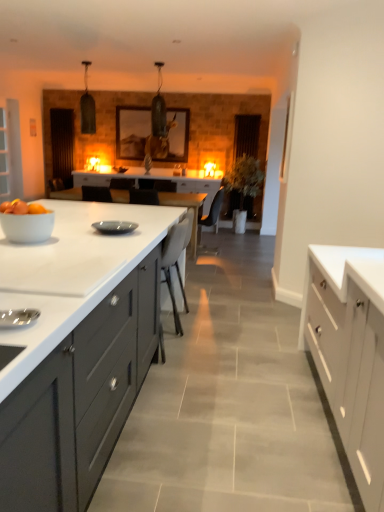
Question: From a real-world perspective, is matte gray cabinets at center, the 2th cabinetry from the right, on top of white glossy bowl at left?

Choices:
 (A) yes
 (B) no

Answer: (B)

Question: Is matte gray cabinets at center, the 2th cabinetry from the right, smaller than white glossy bowl at left?

Choices:
 (A) yes
 (B) no

Answer: (B)

Question: From a real-world perspective, is matte gray cabinets at center, the 2th cabinetry from the right, physically below white glossy bowl at left?

Choices:
 (A) yes
 (B) no

Answer: (A)

Question: Is the depth of matte gray cabinets at center, positioned as the 1th cabinetry in left-to-right order, greater than that of white glossy bowl at left?

Choices:
 (A) no
 (B) yes

Answer: (A)

Question: Does matte gray cabinets at center, positioned as the 1th cabinetry in left-to-right order, contain white glossy bowl at left?

Choices:
 (A) no
 (B) yes

Answer: (A)

Question: Considering the relative positions of matte gray cabinets at center, positioned as the 1th cabinetry in left-to-right order, and white glossy bowl at left in the image provided, is matte gray cabinets at center, positioned as the 1th cabinetry in left-to-right order, in front of white glossy bowl at left?

Choices:
 (A) yes
 (B) no

Answer: (A)

Question: Would you say matte black glass door at upper left, positioned as the second glass door in left-to-right order, is part of white glossy table at center's contents?

Choices:
 (A) yes
 (B) no

Answer: (B)

Question: Can we say white glossy table at center lies outside matte black glass door at upper left, which is counted as the first glass door, starting from the back?

Choices:
 (A) no
 (B) yes

Answer: (B)

Question: From the image's perspective, is white glossy table at center located beneath matte black glass door at upper left, placed as the 2th glass door when sorted from front to back?

Choices:
 (A) yes
 (B) no

Answer: (A)

Question: Considering the relative sizes of white glossy table at center and matte black glass door at upper left, which is counted as the first glass door, starting from the back, in the image provided, is white glossy table at center wider than matte black glass door at upper left, which is counted as the first glass door, starting from the back,?

Choices:
 (A) yes
 (B) no

Answer: (A)

Question: From a real-world perspective, is white glossy table at center beneath matte black glass door at upper left, positioned as the second glass door in left-to-right order?

Choices:
 (A) no
 (B) yes

Answer: (B)

Question: Does white glossy table at center have a greater height compared to matte black glass door at upper left, placed as the 2th glass door when sorted from front to back?

Choices:
 (A) no
 (B) yes

Answer: (A)

Question: Does white glossy table at center turn towards transparent glass door at left, the 2th glass door from the back?

Choices:
 (A) no
 (B) yes

Answer: (B)